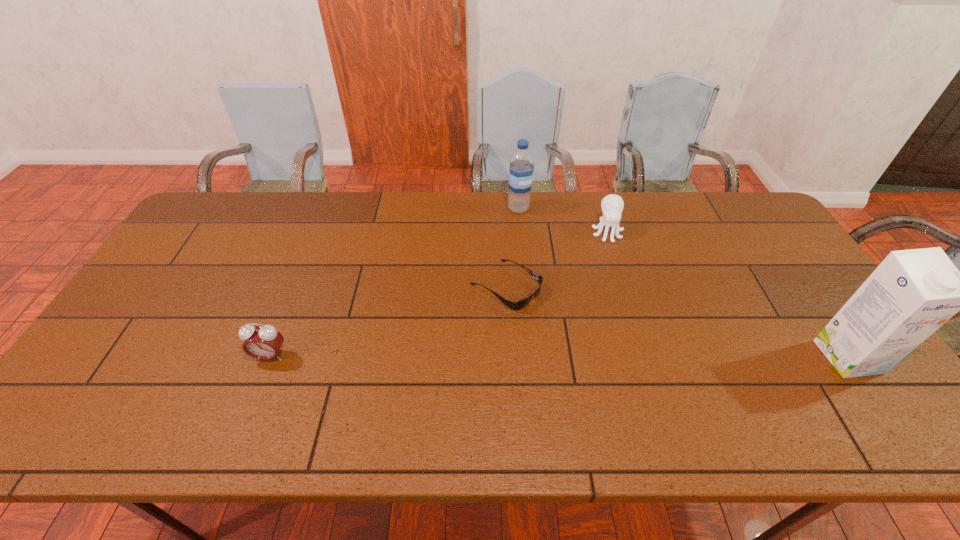
Locate an element on the screen. Image resolution: width=960 pixels, height=540 pixels. vacant space located 0.170m on the left of the rightmost object is located at coordinates (756, 356).

This screenshot has width=960, height=540. Identify the location of vacant space located on the label of the farthest object. (541, 256).

Find the location of a particular element. This screenshot has width=960, height=540. free spot located on the label of the farthest object is located at coordinates (537, 246).

I want to click on free space located 0.210m on the label of the farthest object, so click(x=541, y=256).

Identify the location of free spot located on the front-facing side of the octopus. The image size is (960, 540). (611, 264).

At what (x,y) coordinates should I click in order to perform the action: click on vacant area located on the front-facing side of the octopus. Please return your answer as a coordinate pair (x, y). Image resolution: width=960 pixels, height=540 pixels. Looking at the image, I should click on (615, 326).

Locate an element on the screen. blank area located 0.370m on the front-facing side of the octopus is located at coordinates (616, 338).

Identify the location of free location located 0.080m on the front-facing side of the shortest object. (557, 319).

This screenshot has width=960, height=540. What are the coordinates of `free space located 0.390m on the front-facing side of the shortest object` in the screenshot? It's located at pyautogui.click(x=663, y=389).

Where is `free location located 0.140m on the front-facing side of the shortest object`? Image resolution: width=960 pixels, height=540 pixels. free location located 0.140m on the front-facing side of the shortest object is located at coordinates (576, 331).